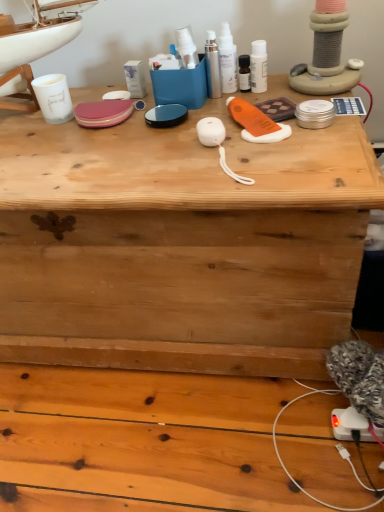
Question: Is sleek silver spray at center, arranged as the third toiletry when viewed from the right, at the left side of white glossy lotion at upper center, which is counted as the 3th toiletry, starting from the left?

Choices:
 (A) no
 (B) yes

Answer: (B)

Question: Is the depth of sleek silver spray at center, arranged as the third toiletry when viewed from the right, greater than that of white glossy lotion at upper center, positioned as the first toiletry in right-to-left order?

Choices:
 (A) yes
 (B) no

Answer: (B)

Question: From a real-world perspective, is sleek silver spray at center, arranged as the third toiletry when viewed from the right, under white glossy lotion at upper center, which is counted as the 3th toiletry, starting from the left?

Choices:
 (A) yes
 (B) no

Answer: (B)

Question: Does sleek silver spray at center, the 1th toiletry viewed from the left, turn towards white glossy lotion at upper center, positioned as the first toiletry in right-to-left order?

Choices:
 (A) yes
 (B) no

Answer: (B)

Question: Considering the relative sizes of sleek silver spray at center, the 1th toiletry viewed from the left, and white glossy lotion at upper center, which is counted as the 3th toiletry, starting from the left, in the image provided, is sleek silver spray at center, the 1th toiletry viewed from the left, smaller than white glossy lotion at upper center, which is counted as the 3th toiletry, starting from the left,?

Choices:
 (A) yes
 (B) no

Answer: (B)

Question: From their relative heights in the image, would you say white glossy spray bottles at upper center, acting as the second toiletry starting from the right, is taller or shorter than white glossy lotion at upper center, which is counted as the 3th toiletry, starting from the left?

Choices:
 (A) tall
 (B) short

Answer: (A)

Question: Is white glossy spray bottles at upper center, arranged as the 2th toiletry when viewed from the left, to the left or to the right of white glossy lotion at upper center, positioned as the first toiletry in right-to-left order, in the image?

Choices:
 (A) right
 (B) left

Answer: (B)

Question: From a real-world perspective, relative to white glossy lotion at upper center, positioned as the first toiletry in right-to-left order, is white glossy spray bottles at upper center, arranged as the 2th toiletry when viewed from the left, vertically above or below?

Choices:
 (A) below
 (B) above

Answer: (B)

Question: Does point (235, 89) appear closer or farther from the camera than point (264, 67)?

Choices:
 (A) farther
 (B) closer

Answer: (A)

Question: Visually, is white glossy lotion at upper center, which is counted as the 3th toiletry, starting from the left, positioned to the left or to the right of sleek silver spray at center, arranged as the third toiletry when viewed from the right?

Choices:
 (A) right
 (B) left

Answer: (A)

Question: From the image's perspective, is white glossy lotion at upper center, positioned as the first toiletry in right-to-left order, positioned above or below sleek silver spray at center, arranged as the third toiletry when viewed from the right?

Choices:
 (A) above
 (B) below

Answer: (B)

Question: Do you think white glossy lotion at upper center, positioned as the first toiletry in right-to-left order, is within sleek silver spray at center, arranged as the third toiletry when viewed from the right, or outside of it?

Choices:
 (A) inside
 (B) outside

Answer: (B)

Question: Looking at the image, does white glossy lotion at upper center, which is counted as the 3th toiletry, starting from the left, seem bigger or smaller compared to sleek silver spray at center, the 1th toiletry viewed from the left?

Choices:
 (A) big
 (B) small

Answer: (B)

Question: In terms of width, does white glossy spray bottles at upper center, acting as the second toiletry starting from the right, look wider or thinner when compared to sleek silver spray at center, the 1th toiletry viewed from the left?

Choices:
 (A) thin
 (B) wide

Answer: (B)

Question: In the image, is white glossy spray bottles at upper center, acting as the second toiletry starting from the right, on the left side or the right side of sleek silver spray at center, the 1th toiletry viewed from the left?

Choices:
 (A) right
 (B) left

Answer: (A)